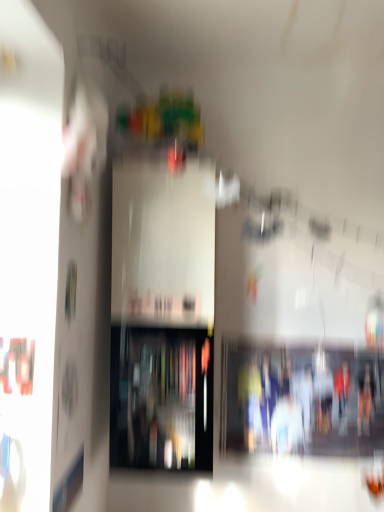
Question: Does point (137, 429) appear closer or farther from the camera than point (347, 450)?

Choices:
 (A) closer
 (B) farther

Answer: (A)

Question: Is transparent glass shelf at center, which is counted as the 2th shelf, starting from the right, bigger or smaller than matte plastic shelf at center, which appears as the 2th shelf when viewed from the left?

Choices:
 (A) small
 (B) big

Answer: (B)

Question: From the image's perspective, is transparent glass shelf at center, placed as the 1th shelf when sorted from left to right, located above or below matte plastic shelf at center, which appears as the 2th shelf when viewed from the left?

Choices:
 (A) above
 (B) below

Answer: (A)

Question: Relative to transparent glass shelf at center, placed as the 1th shelf when sorted from left to right, is matte plastic shelf at center, which is the 1th shelf from right to left, in front or behind?

Choices:
 (A) front
 (B) behind

Answer: (B)

Question: Is matte plastic shelf at center, which is the 1th shelf from right to left, wider or thinner than transparent glass shelf at center, which is counted as the 2th shelf, starting from the right?

Choices:
 (A) wide
 (B) thin

Answer: (B)

Question: Visually, is matte plastic shelf at center, which is the 1th shelf from right to left, positioned to the left or to the right of transparent glass shelf at center, placed as the 1th shelf when sorted from left to right?

Choices:
 (A) right
 (B) left

Answer: (A)

Question: Considering the positions of matte plastic shelf at center, which is the 1th shelf from right to left, and transparent glass shelf at center, which is counted as the 2th shelf, starting from the right, in the image, is matte plastic shelf at center, which is the 1th shelf from right to left, bigger or smaller than transparent glass shelf at center, which is counted as the 2th shelf, starting from the right,?

Choices:
 (A) small
 (B) big

Answer: (A)